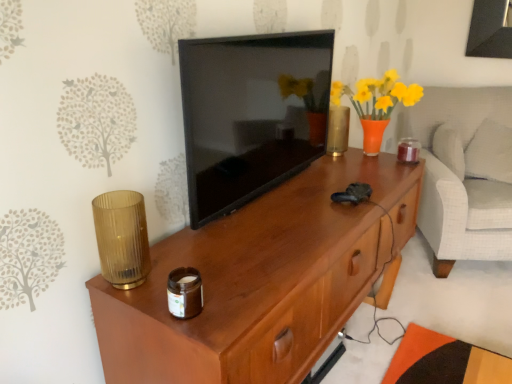
The image size is (512, 384). Find the location of `vacant area that lies between black glossy tv at center and translucent amber glass candle at right, the 3th candle holder viewed from the left`. vacant area that lies between black glossy tv at center and translucent amber glass candle at right, the 3th candle holder viewed from the left is located at coordinates (318, 184).